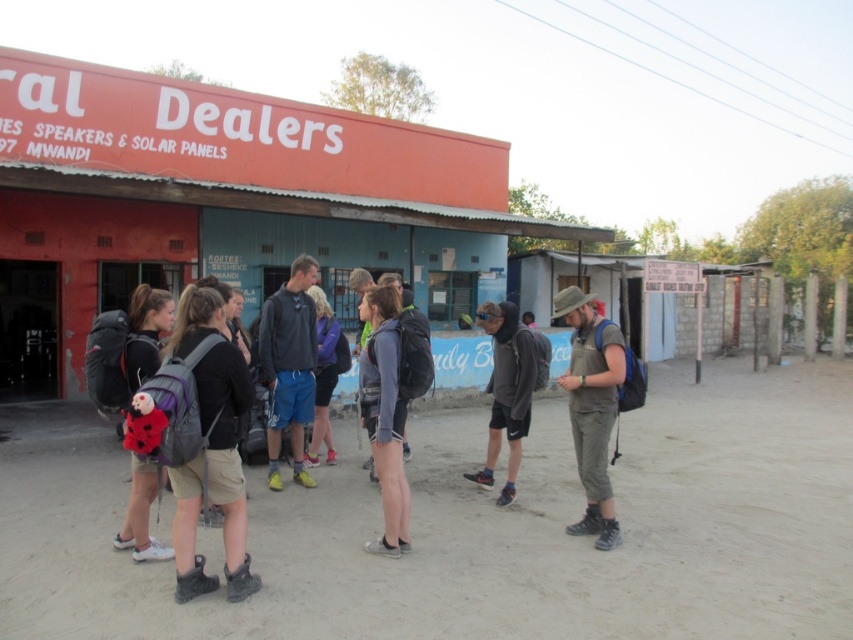
Can you confirm if matte khaki pants at center is taller than purple fabric backpack at center?

Yes.

Can you confirm if matte khaki pants at center is positioned above purple fabric backpack at center?

No.

Image resolution: width=853 pixels, height=640 pixels. What do you see at coordinates (590, 408) in the screenshot? I see `matte khaki pants at center` at bounding box center [590, 408].

You are a GUI agent. You are given a task and a screenshot of the screen. Output one action in this format:
    pyautogui.click(x=<x>, y=<y>)
    Task: Click on the matte khaki pants at center
    The height and width of the screenshot is (640, 853).
    Given the screenshot: What is the action you would take?
    pyautogui.click(x=590, y=408)

Is blue fabric shorts at center positioned behind matte black backpack at left?

Yes, blue fabric shorts at center is further from the viewer.

Does blue fabric shorts at center come in front of matte black backpack at left?

No, it is not.

Which is in front, point (306, 486) or point (154, 364)?

Point (154, 364) is in front.

Where is `blue fabric shorts at center`? blue fabric shorts at center is located at coordinates (289, 365).

Can you confirm if gray matte jacket at center is positioned above matte black backpack at left?

Correct, gray matte jacket at center is located above matte black backpack at left.

In the scene shown: Who is shorter, gray matte jacket at center or matte black backpack at left?

matte black backpack at left is shorter.

Who is more forward, (401, 435) or (155, 349)?

Point (155, 349) is in front.

You are a GUI agent. You are given a task and a screenshot of the screen. Output one action in this format:
    pyautogui.click(x=<x>, y=<y>)
    Task: Click on the gray matte jacket at center
    The height and width of the screenshot is (640, 853).
    Given the screenshot: What is the action you would take?
    pyautogui.click(x=384, y=413)